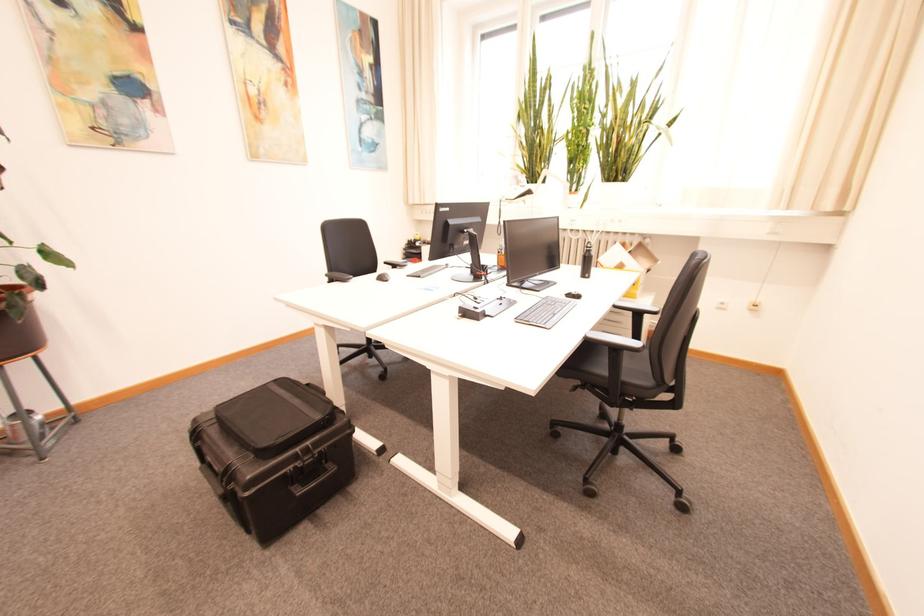
This screenshot has width=924, height=616. What do you see at coordinates (586, 260) in the screenshot? I see `a black bottle lid` at bounding box center [586, 260].